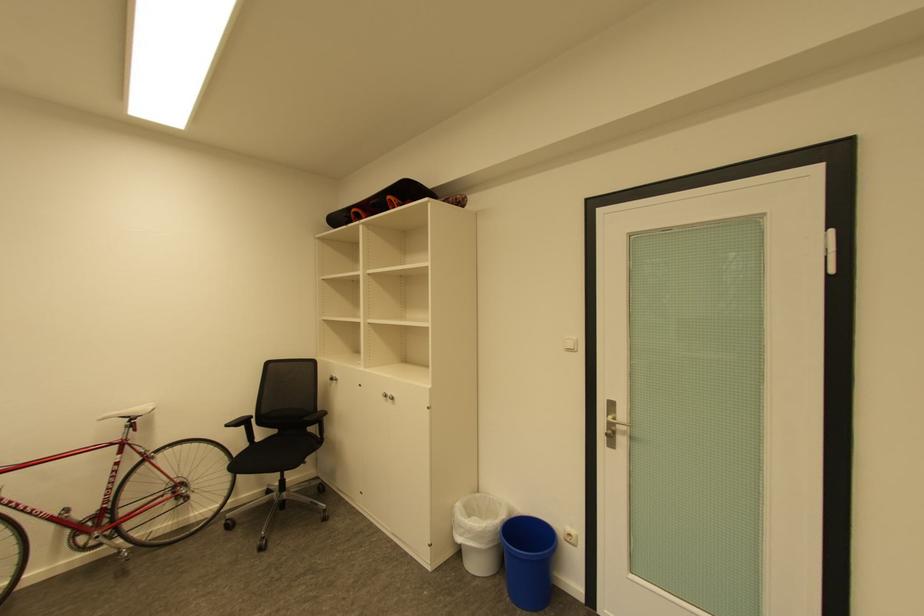
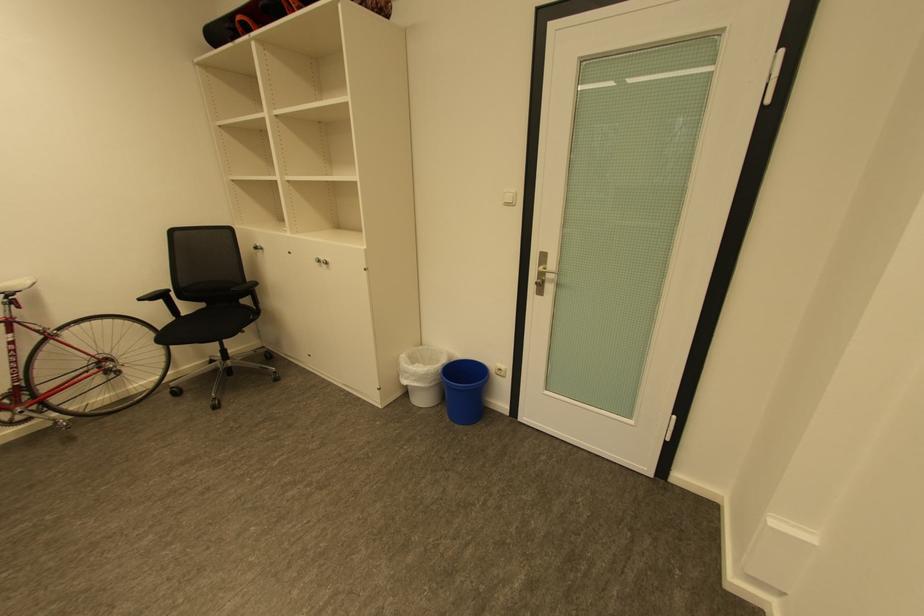
Find the pixel in the second image that matches (x=468, y=528) in the first image.

(414, 373)